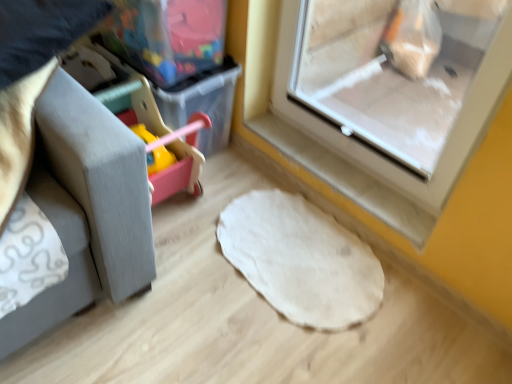
Question: Can you confirm if transparent plastic screen door at upper right is thinner than white felt mat at center?

Choices:
 (A) yes
 (B) no

Answer: (A)

Question: Can you confirm if transparent plastic screen door at upper right is taller than white felt mat at center?

Choices:
 (A) yes
 (B) no

Answer: (A)

Question: From a real-world perspective, is transparent plastic screen door at upper right on white felt mat at center?

Choices:
 (A) no
 (B) yes

Answer: (B)

Question: From the image's perspective, is transparent plastic screen door at upper right above white felt mat at center?

Choices:
 (A) no
 (B) yes

Answer: (B)

Question: Is transparent plastic screen door at upper right to the right of white felt mat at center from the viewer's perspective?

Choices:
 (A) no
 (B) yes

Answer: (B)

Question: Is translucent plastic storage box at upper left wider or thinner than transparent plastic screen door at upper right?

Choices:
 (A) wide
 (B) thin

Answer: (A)

Question: Relative to transparent plastic screen door at upper right, is translucent plastic storage box at upper left in front or behind?

Choices:
 (A) behind
 (B) front

Answer: (A)

Question: Considering the positions of point (162, 86) and point (437, 6), is point (162, 86) closer or farther from the camera than point (437, 6)?

Choices:
 (A) farther
 (B) closer

Answer: (B)

Question: Is translucent plastic storage box at upper left inside the boundaries of transparent plastic screen door at upper right, or outside?

Choices:
 (A) outside
 (B) inside

Answer: (A)

Question: Choose the correct answer: Is white felt mat at center inside translucent plastic storage box at upper left or outside it?

Choices:
 (A) inside
 (B) outside

Answer: (B)

Question: Looking at their shapes, would you say white felt mat at center is wider or thinner than translucent plastic storage box at upper left?

Choices:
 (A) thin
 (B) wide

Answer: (A)

Question: From the image's perspective, is white felt mat at center positioned above or below translucent plastic storage box at upper left?

Choices:
 (A) below
 (B) above

Answer: (A)

Question: Visually, is white felt mat at center positioned to the left or to the right of translucent plastic storage box at upper left?

Choices:
 (A) left
 (B) right

Answer: (B)

Question: Is point [x=373, y=294] closer or farther from the camera than point [x=373, y=64]?

Choices:
 (A) farther
 (B) closer

Answer: (B)

Question: From a real-world perspective, is white felt mat at center physically located above or below transparent plastic screen door at upper right?

Choices:
 (A) above
 (B) below

Answer: (B)